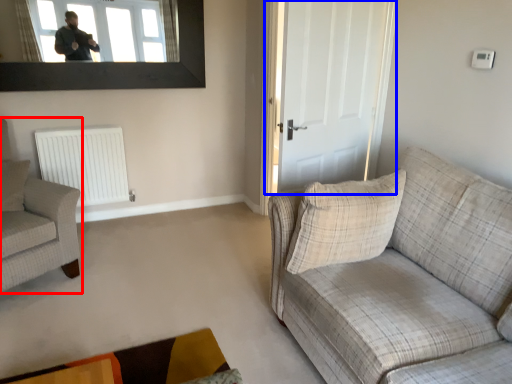
Question: Which point is closer to the camera, chair (highlighted by a red box) or door (highlighted by a blue box)?

Choices:
 (A) chair
 (B) door

Answer: (A)